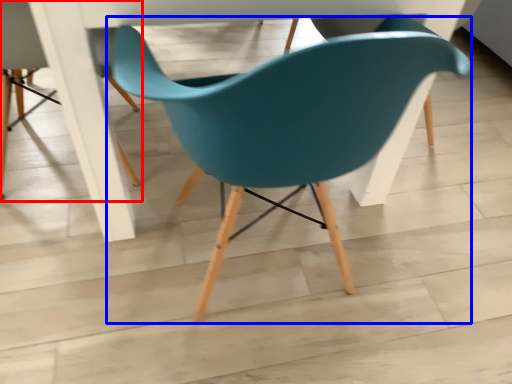
Question: Among these objects, which one is nearest to the camera, chair (highlighted by a red box) or chair (highlighted by a blue box)?

Choices:
 (A) chair
 (B) chair

Answer: (B)